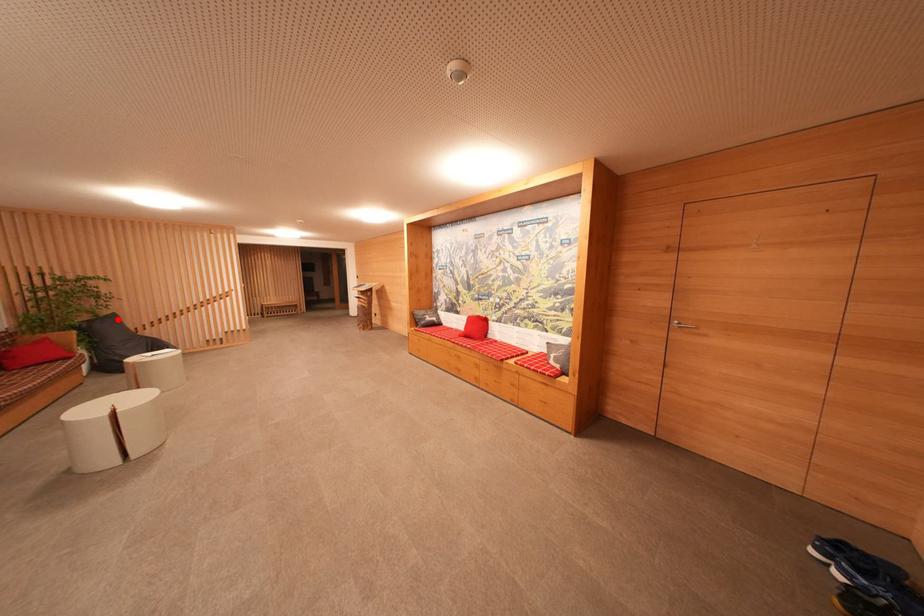
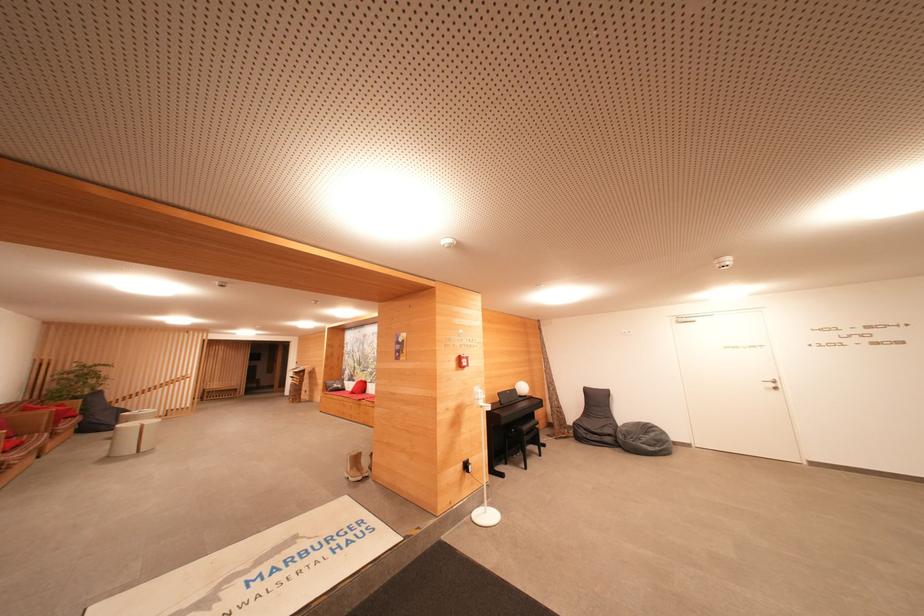
In the second image, find the point that corresponds to the highlighted location in the first image.

(103, 395)